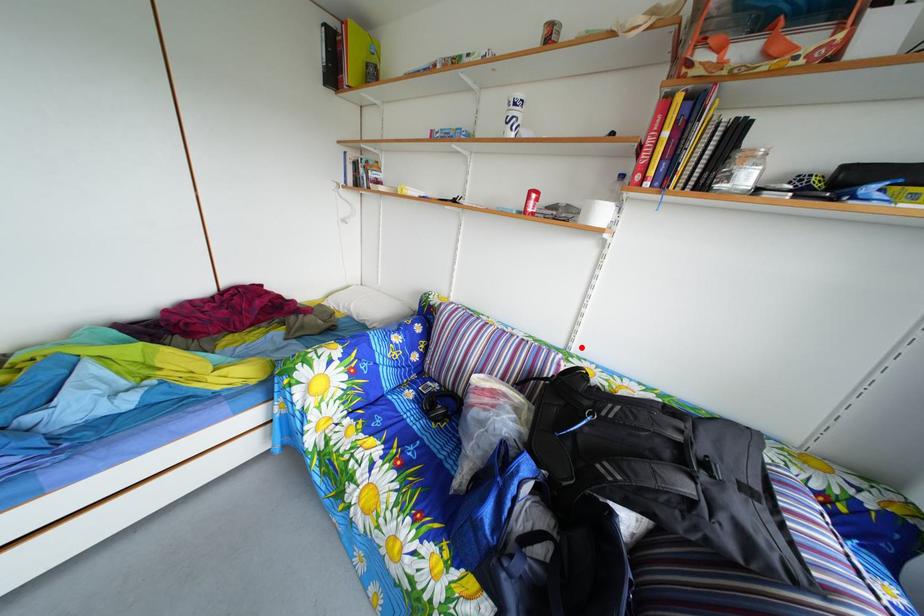
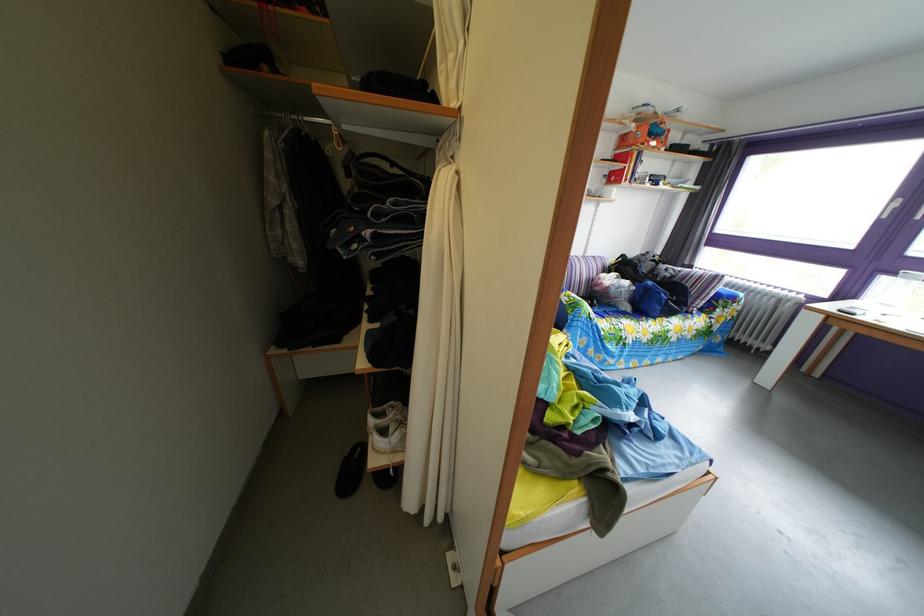
Question: I am providing you with two images of the same scene from different viewpoints. A red point is marked on the first image. At the location where the point appears in image 1, is it still visible in image 2?

Choices:
 (A) Yes
 (B) No

Answer: (A)